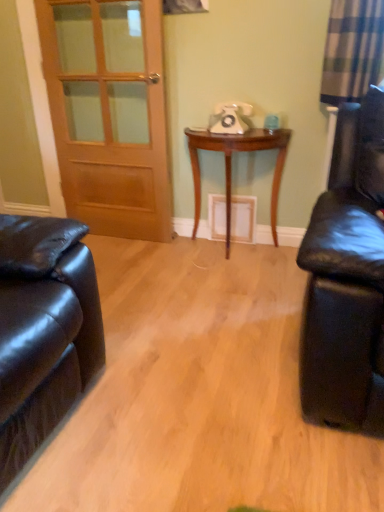
Question: Is point (147, 142) positioned closer to the camera than point (273, 193)?

Choices:
 (A) closer
 (B) farther

Answer: (B)

Question: Visually, is wooden door at left positioned to the left or to the right of woodenmaterial/texturetable at center?

Choices:
 (A) left
 (B) right

Answer: (A)

Question: In terms of width, does wooden door at left look wider or thinner when compared to woodenmaterial/texturetable at center?

Choices:
 (A) wide
 (B) thin

Answer: (B)

Question: In terms of height, does woodenmaterial/texturetable at center look taller or shorter compared to wooden door at left?

Choices:
 (A) tall
 (B) short

Answer: (B)

Question: From a real-world perspective, relative to wooden door at left, is woodenmaterial/texturetable at center vertically above or below?

Choices:
 (A) below
 (B) above

Answer: (A)

Question: Considering the relative positions of woodenmaterial/texturetable at center and wooden door at left in the image provided, is woodenmaterial/texturetable at center to the left or to the right of wooden door at left?

Choices:
 (A) left
 (B) right

Answer: (B)

Question: Considering the positions of point (258, 139) and point (147, 14), is point (258, 139) closer or farther from the camera than point (147, 14)?

Choices:
 (A) closer
 (B) farther

Answer: (A)